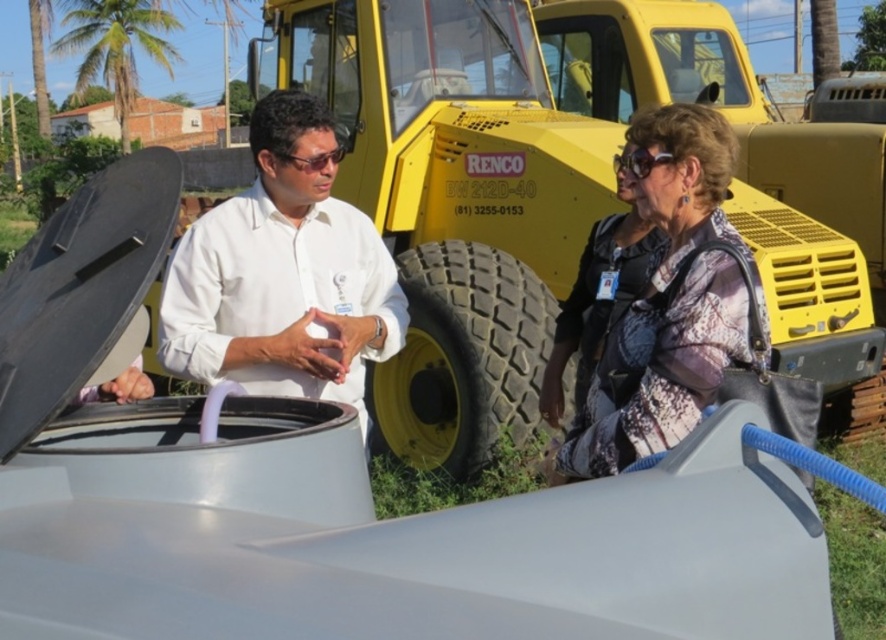
Between white matte shirt at center and patterned fabric dress at center, which one has more height?

patterned fabric dress at center

Can you confirm if white matte shirt at center is positioned to the left of patterned fabric dress at center?

Yes, white matte shirt at center is to the left of patterned fabric dress at center.

Describe the element at coordinates (284, 273) in the screenshot. This screenshot has width=886, height=640. I see `white matte shirt at center` at that location.

Where is `white matte shirt at center`? This screenshot has height=640, width=886. white matte shirt at center is located at coordinates (284, 273).

Is white matte shirt at center wider than black rubber tire at center?

Incorrect, white matte shirt at center's width does not surpass black rubber tire at center's.

What are the coordinates of `white matte shirt at center` in the screenshot? It's located at (284, 273).

What do you see at coordinates (284, 273) in the screenshot? The width and height of the screenshot is (886, 640). I see `white matte shirt at center` at bounding box center [284, 273].

This screenshot has width=886, height=640. I want to click on white matte shirt at center, so click(284, 273).

Between patterned fabric dress at center and sunglasses at upper right, which one is positioned higher?

Positioned higher is sunglasses at upper right.

Who is more distant from viewer, (619, 355) or (663, 157)?

The point (619, 355) is more distant.

Does point (724, 164) lie in front of point (623, 156)?

Yes, point (724, 164) is in front of point (623, 156).

Where is `patterned fabric dress at center`? patterned fabric dress at center is located at coordinates (669, 305).